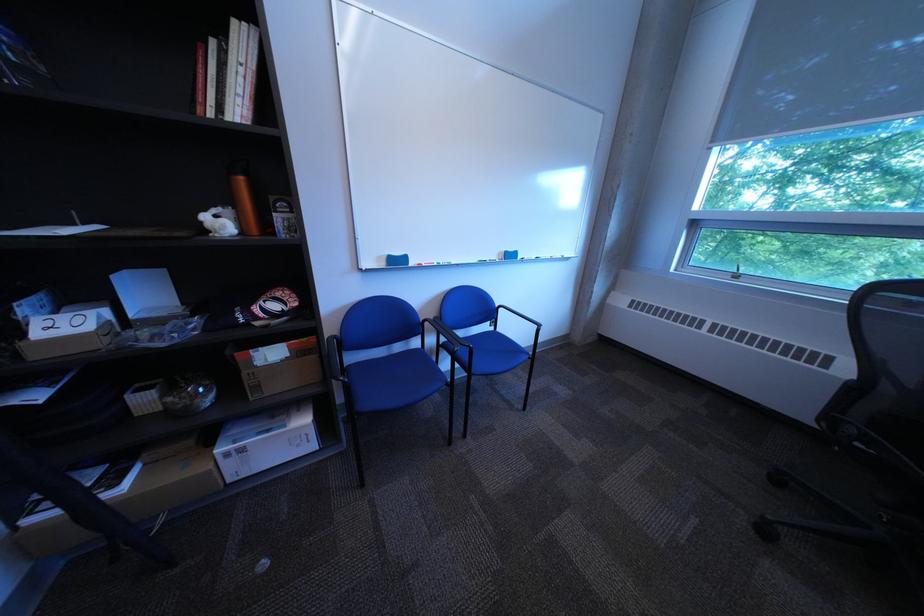
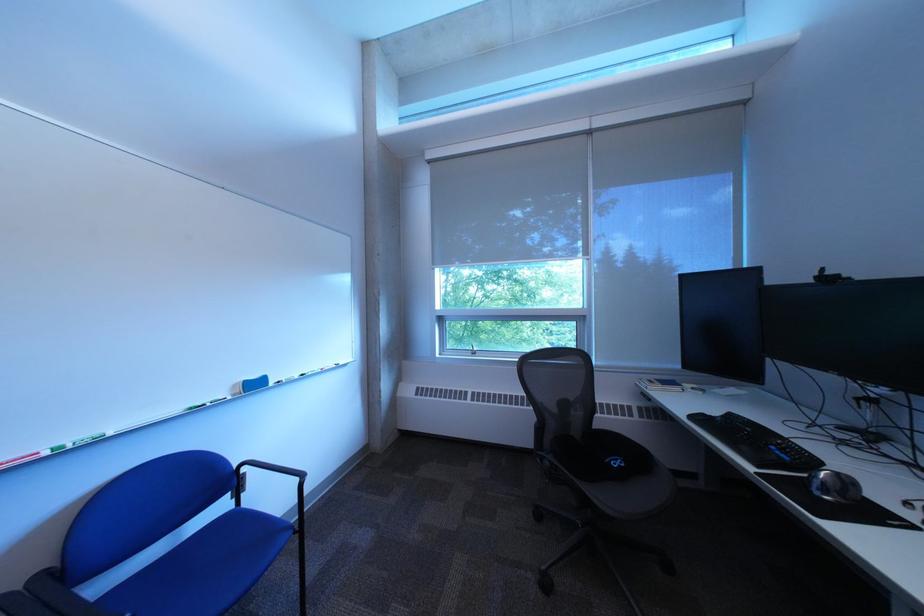
In the second image, find the point that corresponds to (x=515, y=254) in the first image.

(249, 387)